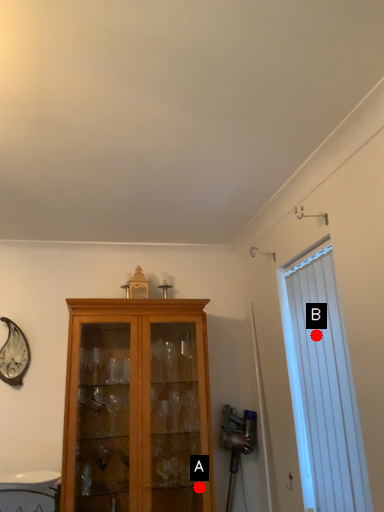
Question: Two points are circled on the image, labeled by A and B beside each circle. Which point is further to the camera?

Choices:
 (A) A is further
 (B) B is further

Answer: (A)